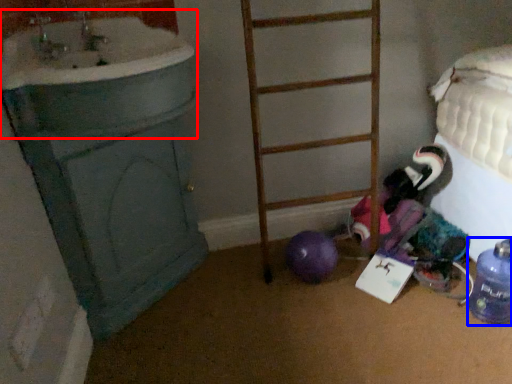
Question: Which object is further to the camera taking this photo, sink (highlighted by a red box) or bottle (highlighted by a blue box)?

Choices:
 (A) sink
 (B) bottle

Answer: (B)